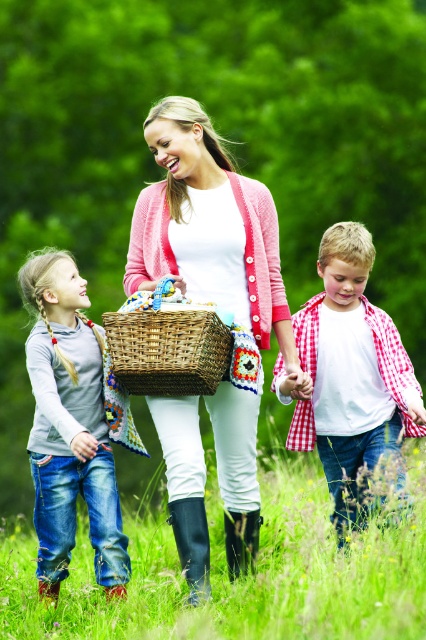
Question: Observing the image, what is the correct spatial positioning of denim jeans at left in reference to woven wicker basket at center?

Choices:
 (A) right
 (B) left

Answer: (B)

Question: Which point is farther to the camera?

Choices:
 (A) (48, 332)
 (B) (348, 349)

Answer: (B)

Question: Can you confirm if pink knitted cardigan at center is thinner than white checkered shirt at center?

Choices:
 (A) no
 (B) yes

Answer: (A)

Question: Among these objects, which one is farthest from the camera?

Choices:
 (A) woven wicker basket at center
 (B) green grass at lower center
 (C) denim jeans at left

Answer: (C)

Question: Which object is the farthest from the denim jeans at left?

Choices:
 (A) white checkered shirt at center
 (B) pink knitted cardigan at center

Answer: (A)

Question: Is green grass at lower center closer to the viewer compared to white checkered shirt at center?

Choices:
 (A) no
 (B) yes

Answer: (B)